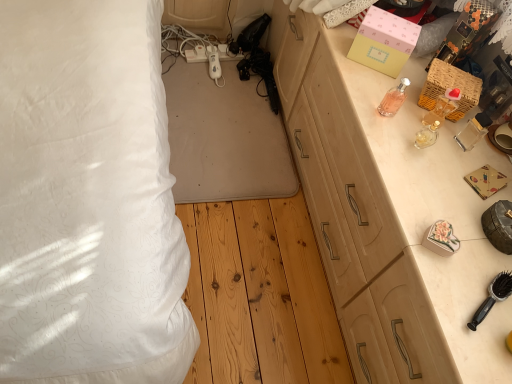
Image resolution: width=512 pixels, height=384 pixels. In order to click on vacant area that is situated to the right of translucent glass perfume at right, the second perfume from the left in this screenshot , I will do `click(457, 154)`.